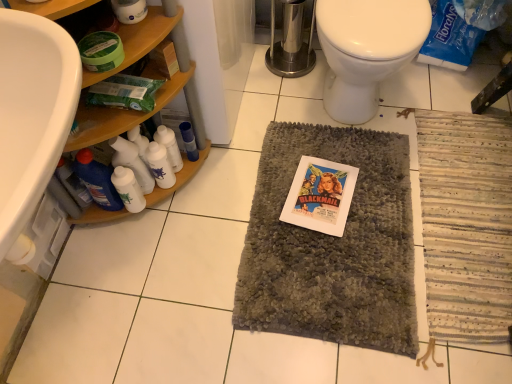
Locate an element on the screen. This screenshot has width=512, height=384. vacant space to the right of blue plastic bottle at center, which is the 5th bottle from left to right is located at coordinates coord(237,159).